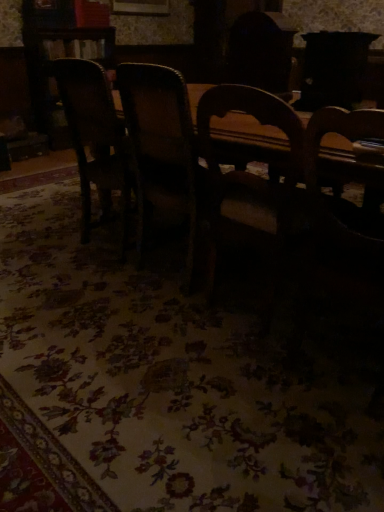
Question: In terms of width, does wooden chair at center, which ranks as the second chair in left-to-right order, look wider or thinner when compared to wooden chair at left, marked as the first chair in a left-to-right arrangement?

Choices:
 (A) thin
 (B) wide

Answer: (B)

Question: Is point (137, 199) closer or farther from the camera than point (86, 111)?

Choices:
 (A) closer
 (B) farther

Answer: (A)

Question: From their relative heights in the image, would you say wooden chair at center, which ranks as the second chair in left-to-right order, is taller or shorter than wooden chair at left, acting as the second chair starting from the right?

Choices:
 (A) short
 (B) tall

Answer: (B)

Question: Looking at their shapes, would you say wooden chair at left, acting as the second chair starting from the right, is wider or thinner than wooden chair at center, which ranks as the second chair in left-to-right order?

Choices:
 (A) wide
 (B) thin

Answer: (B)

Question: Is point (120, 254) positioned closer to the camera than point (140, 240)?

Choices:
 (A) closer
 (B) farther

Answer: (B)

Question: From a real-world perspective, is wooden chair at left, marked as the first chair in a left-to-right arrangement, physically located above or below wooden chair at center, the first chair viewed from the right?

Choices:
 (A) above
 (B) below

Answer: (B)

Question: In the image, is wooden chair at left, marked as the first chair in a left-to-right arrangement, positioned in front of or behind wooden chair at center, the first chair viewed from the right?

Choices:
 (A) behind
 (B) front

Answer: (A)